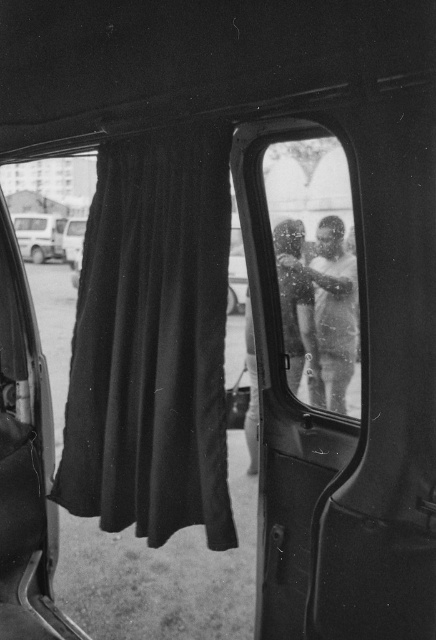
You are a delivery person trying to secure your packages inside the van. You notice the black velvet curtain at left and the metallic silver van at left. Which object would be easier to fold or roll up for storage?

The black velvet curtain at left is thinner than the metallic silver van at left, so the black velvet curtain at left would be easier to fold or roll up for storage.

You are sitting in a vehicle and want to see outside through the open door. There is a point marked at coordinate (x=152, y=340) which is part of the black velvet curtain at left. Is there any part of the black velvet curtain at left that is not blocking your view to the outside?

The point at (x=152, y=340) marks the black velvet curtain at left, but since the curtain is only at the left side, the right side of the open door might not be blocked. Therefore, you can see outside through the open door by looking to the right of the black velvet curtain at left.

You are sitting in the vehicle and want to know the relative positions of two points outside the open rear door. The points are labeled as point (19, 236) and point (79, 227). From your perspective inside the vehicle, which point is closer to the door?

Point (79, 227) is closer to the door because it is in front of point (19, 236), which is behind it.